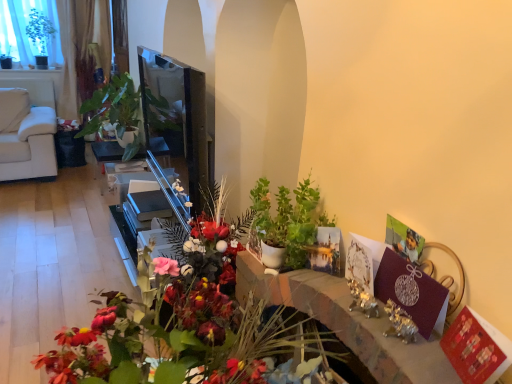
From the picture: Measure the distance between point (194, 245) and camera.

5.96 feet.

Measure the distance between point (85, 107) and camera.

Point (85, 107) is 4.00 meters away from camera.

Locate an element on the screen. The height and width of the screenshot is (384, 512). matte black table at center is located at coordinates (106, 151).

In the scene shown: Between green matte plant at center, positioned as the 2th houseplant in back-to-front order, and green glossy plant at upper left, positioned as the 1th houseplant in left-to-right order, which one has smaller size?

Smaller between the two is green matte plant at center, positioned as the 2th houseplant in back-to-front order.

From a real-world perspective, is green matte plant at center, acting as the first houseplant starting from the bottom, physically located above or below green glossy plant at upper left, acting as the second houseplant starting from the front?

green matte plant at center, acting as the first houseplant starting from the bottom, is situated higher than green glossy plant at upper left, acting as the second houseplant starting from the front, in the real world.

Is green matte plant at center, placed as the first houseplant when sorted from right to left, to the left or to the right of green glossy plant at upper left, acting as the second houseplant starting from the front, in the image?

green matte plant at center, placed as the first houseplant when sorted from right to left, is positioned on green glossy plant at upper left, acting as the second houseplant starting from the front,'s right side.

Consider the image. From the image's perspective, which one is positioned higher, green matte plant at center, which is counted as the 2th houseplant, starting from the top, or green glossy plant at upper left, positioned as the 1th houseplant in left-to-right order?

green glossy plant at upper left, positioned as the 1th houseplant in left-to-right order, from the image's perspective.

Find the location of a particular element. houseplant that is on the right side of green glossy plant at upper left, positioned as the first houseplant in back-to-front order is located at coordinates [x=288, y=220].

In terms of width, does green glossy plant at upper left, positioned as the 1th houseplant in left-to-right order, look wider or thinner when compared to green matte plant at center, positioned as the 2th houseplant in back-to-front order?

Clearly, green glossy plant at upper left, positioned as the 1th houseplant in left-to-right order, has more width compared to green matte plant at center, positioned as the 2th houseplant in back-to-front order.

Is green glossy plant at upper left, positioned as the 1th houseplant in left-to-right order, closer to the viewer compared to green matte plant at center, placed as the second houseplant when sorted from left to right?

No, it is not.

In terms of width, does matte floral arrangement at center look wider or thinner when compared to green leafy plant at upper left?

Clearly, matte floral arrangement at center has more width compared to green leafy plant at upper left.

How much distance is there between matte floral arrangement at center and green leafy plant at upper left?

matte floral arrangement at center is 15.85 feet from green leafy plant at upper left.

Is matte floral arrangement at center positioned in front of green leafy plant at upper left?

That is True.

Is matte floral arrangement at center next to green leafy plant at upper left?

No, matte floral arrangement at center is not touching green leafy plant at upper left.

Is green glossy plant at upper left, marked as the second houseplant in a right-to-left arrangement, further to camera compared to matte floral arrangement at center?

Yes, it is behind matte floral arrangement at center.

Between green glossy plant at upper left, which is the 2th houseplant in bottom-to-top order, and matte floral arrangement at center, which one has smaller size?

With smaller size is green glossy plant at upper left, which is the 2th houseplant in bottom-to-top order.

Is green glossy plant at upper left, positioned as the first houseplant in back-to-front order, looking in the opposite direction of matte floral arrangement at center?

No.

Based on the photo, from a real-world perspective, who is located higher, matte black table at center or green matte plant at center, positioned as the 2th houseplant in back-to-front order?

From a 3D spatial view, green matte plant at center, positioned as the 2th houseplant in back-to-front order, is above.

Image resolution: width=512 pixels, height=384 pixels. What are the coordinates of `table above the green matte plant at center, placed as the second houseplant when sorted from left to right (from the image's perspective)` in the screenshot? It's located at (106, 151).

Which object is further away from the camera, matte black table at center or green matte plant at center, placed as the second houseplant when sorted from left to right?

matte black table at center is further from the camera.

Does matte black table at center have a smaller size compared to green matte plant at center, placed as the second houseplant when sorted from left to right?

No, matte black table at center is not smaller than green matte plant at center, placed as the second houseplant when sorted from left to right.

In the scene shown: Is green matte plant at center, acting as the first houseplant starting from the bottom, at the right side of green leafy plant at upper left?

Correct, you'll find green matte plant at center, acting as the first houseplant starting from the bottom, to the right of green leafy plant at upper left.

From the image's perspective, is green matte plant at center, placed as the 1th houseplant when sorted from front to back, above or below green leafy plant at upper left?

green matte plant at center, placed as the 1th houseplant when sorted from front to back, is below green leafy plant at upper left.

Based on the photo, between green matte plant at center, acting as the first houseplant starting from the bottom, and green leafy plant at upper left, which one has less height?

green matte plant at center, acting as the first houseplant starting from the bottom.

From the image's perspective, relative to matte black table at center, is green glossy plant at upper left, which is the 2th houseplant in bottom-to-top order, above or below?

From the image's perspective, green glossy plant at upper left, which is the 2th houseplant in bottom-to-top order, appears above matte black table at center.

Which of these two, green glossy plant at upper left, positioned as the 1th houseplant in left-to-right order, or matte black table at center, stands taller?

green glossy plant at upper left, positioned as the 1th houseplant in left-to-right order.

Looking at this image, which object is wider, green glossy plant at upper left, acting as the second houseplant starting from the front, or matte black table at center?

Wider between the two is green glossy plant at upper left, acting as the second houseplant starting from the front.

Is green glossy plant at upper left, marked as the second houseplant in a right-to-left arrangement, to the left of matte black table at center from the viewer's perspective?

Indeed, green glossy plant at upper left, marked as the second houseplant in a right-to-left arrangement, is positioned on the left side of matte black table at center.

You are a GUI agent. You are given a task and a screenshot of the screen. Output one action in this format:
    pyautogui.click(x=<x>, y=<y>)
    Task: Click on the houseplant located underneath the green matte plant at center, placed as the first houseplant when sorted from right to left (from a real-world perspective)
    The width and height of the screenshot is (512, 384).
    Given the screenshot: What is the action you would take?
    pyautogui.click(x=112, y=107)

Identify the location of houseplant on the left of green matte plant at center, positioned as the 2th houseplant in back-to-front order. (112, 107).

From the image, which object appears to be nearer to matte floral arrangement at center, green leafy plant at upper left or green glossy plant at upper left, positioned as the first houseplant in back-to-front order?

green glossy plant at upper left, positioned as the first houseplant in back-to-front order.

Considering their positions, is matte black table at center positioned further to green matte plant at center, acting as the first houseplant starting from the bottom, than green leafy plant at upper left?

green leafy plant at upper left lies further to green matte plant at center, acting as the first houseplant starting from the bottom, than the other object.

Which object lies nearer to the anchor point matte floral arrangement at center, green matte plant at center, which is counted as the 2th houseplant, starting from the top, or matte black table at center?

green matte plant at center, which is counted as the 2th houseplant, starting from the top, is positioned closer to the anchor matte floral arrangement at center.

From the image, which object appears to be farther from green matte plant at center, which is counted as the 2th houseplant, starting from the top, green leafy plant at upper left or matte black table at center?

green leafy plant at upper left is positioned further to the anchor green matte plant at center, which is counted as the 2th houseplant, starting from the top.

Looking at the image, which one is located further to green matte plant at center, positioned as the 2th houseplant in back-to-front order, matte floral arrangement at center or matte black table at center?

matte black table at center is positioned further to the anchor green matte plant at center, positioned as the 2th houseplant in back-to-front order.

From the image, which object appears to be nearer to green glossy plant at upper left, positioned as the 1th houseplant in left-to-right order, green matte plant at center, placed as the second houseplant when sorted from left to right, or green leafy plant at upper left?

Among the two, green leafy plant at upper left is located nearer to green glossy plant at upper left, positioned as the 1th houseplant in left-to-right order.

From the picture: Considering their positions, is green matte plant at center, positioned as the 2th houseplant in back-to-front order, positioned further to green leafy plant at upper left than green glossy plant at upper left, acting as the second houseplant starting from the front?

green matte plant at center, positioned as the 2th houseplant in back-to-front order.

From the image, which object appears to be farther from green glossy plant at upper left, acting as the second houseplant starting from the front, green matte plant at center, placed as the second houseplant when sorted from left to right, or matte floral arrangement at center?

matte floral arrangement at center.

I want to click on houseplant between green leafy plant at upper left and matte black table at center vertically, so click(112, 107).

Identify the location of houseplant located between matte floral arrangement at center and green glossy plant at upper left, acting as the second houseplant starting from the front, in the depth direction. (288, 220).

Identify the location of table positioned between green matte plant at center, placed as the first houseplant when sorted from right to left, and green leafy plant at upper left from near to far. The height and width of the screenshot is (384, 512). (106, 151).

Where is `table positioned between matte floral arrangement at center and green leafy plant at upper left from near to far`? table positioned between matte floral arrangement at center and green leafy plant at upper left from near to far is located at coordinates coord(106,151).